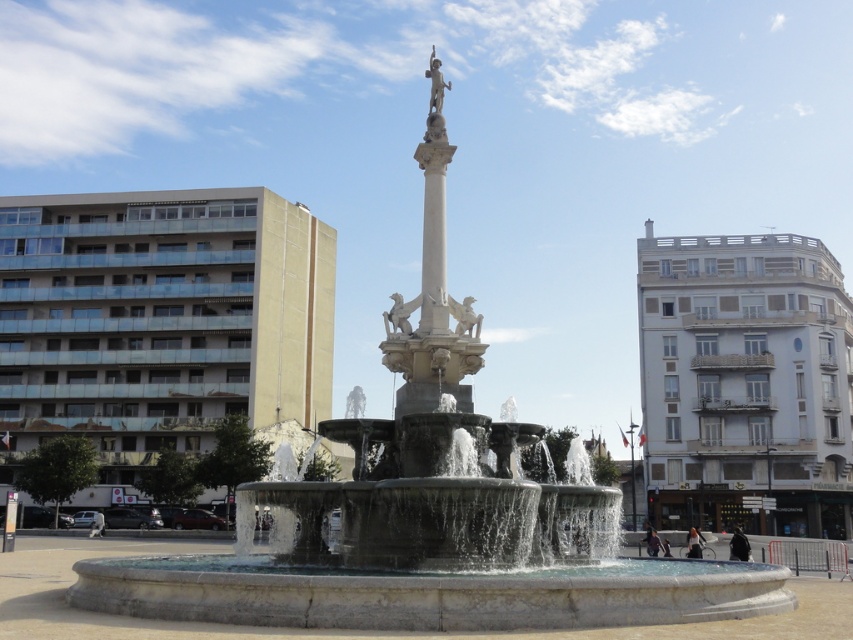
Question: In this image, where is white concrete building at right located relative to white marble column at center?

Choices:
 (A) right
 (B) left

Answer: (A)

Question: Estimate the real-world distances between objects in this image. Which object is farther from the beige concrete building at left?

Choices:
 (A) white concrete building at right
 (B) white marble column at center

Answer: (B)

Question: Does beige concrete building at left appear over white concrete building at right?

Choices:
 (A) no
 (B) yes

Answer: (B)

Question: Which point is farther to the camera?

Choices:
 (A) (662, 272)
 (B) (184, 406)

Answer: (A)

Question: Which point is closer to the camera?

Choices:
 (A) (439, 349)
 (B) (795, 330)
 (C) (248, 388)

Answer: (A)

Question: Is white concrete building at right below white marble column at center?

Choices:
 (A) no
 (B) yes

Answer: (B)